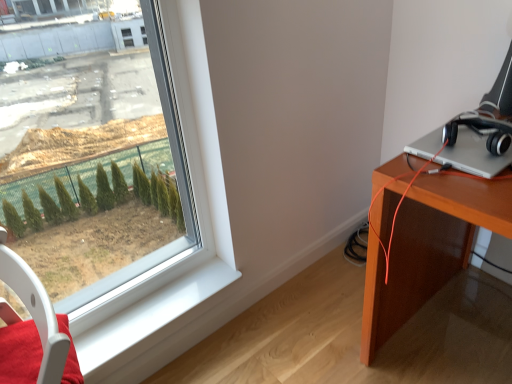
Find the location of `empty space that is to the right of clear glass window at left`. empty space that is to the right of clear glass window at left is located at coordinates (x=186, y=291).